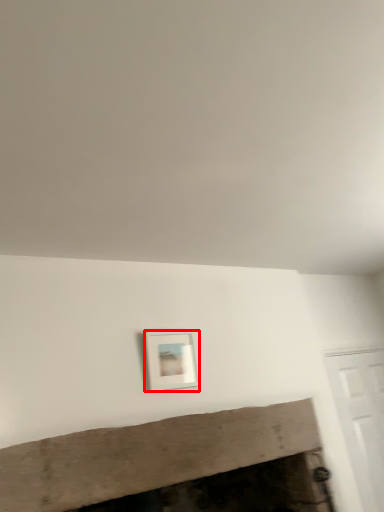
Question: From the image's perspective, what is the correct spatial relationship of picture frame (annotated by the red box) in relation to fireplace?

Choices:
 (A) above
 (B) below

Answer: (A)